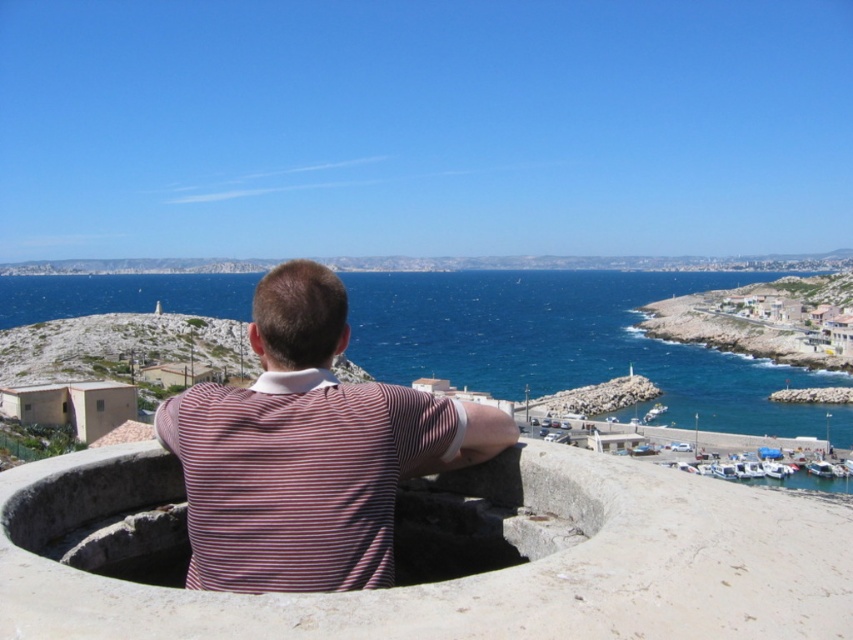
Question: Is striped cotton shirt at center to the left of blue water at center from the viewer's perspective?

Choices:
 (A) yes
 (B) no

Answer: (A)

Question: Which point is closer to the camera taking this photo?

Choices:
 (A) (289, 436)
 (B) (410, 314)

Answer: (A)

Question: In this image, where is striped cotton shirt at center located relative to blue water at center?

Choices:
 (A) below
 (B) above

Answer: (A)

Question: Does striped cotton shirt at center have a lesser width compared to blue water at center?

Choices:
 (A) yes
 (B) no

Answer: (A)

Question: Which point is farther to the camera?

Choices:
 (A) (167, 285)
 (B) (206, 524)

Answer: (A)